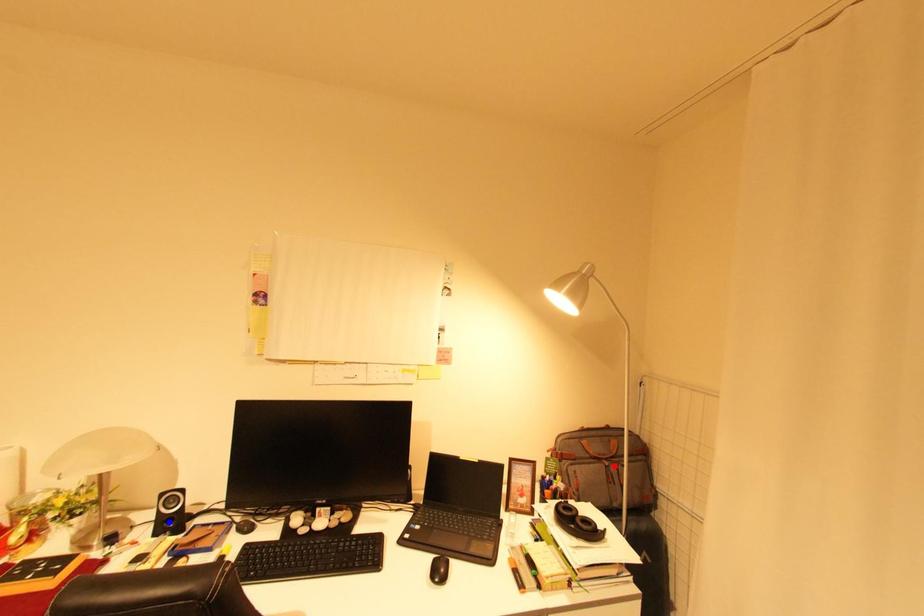
Question: Two points are marked on the image. Which point is closer to the camera?

Choices:
 (A) Blue point is closer.
 (B) Red point is closer.

Answer: (A)